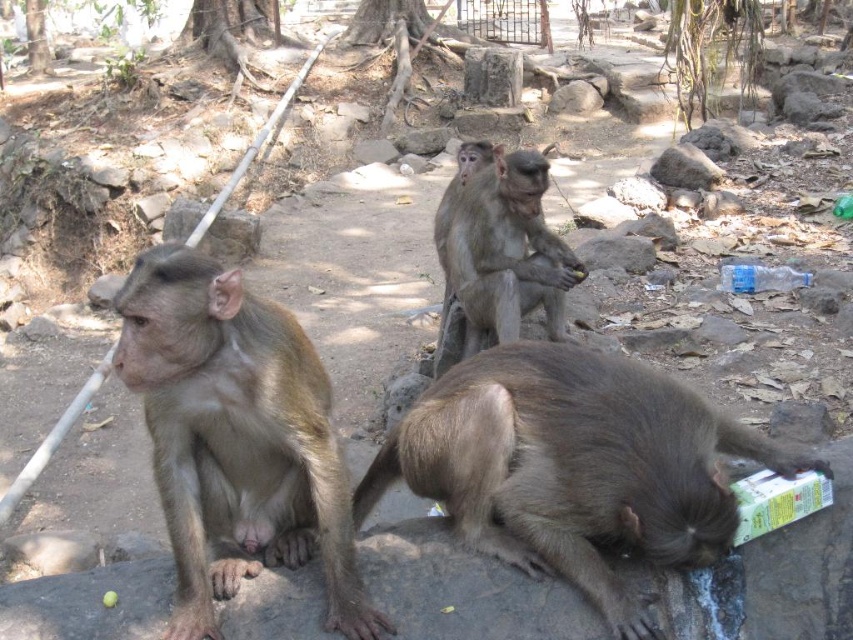
You are a wildlife photographer standing at the camera position. You want to capture a closeup shot of the brown furry monkey at lower right. Given that your camera has a minimum focusing distance of 5 feet, will you be able to take a clear photo?

The brown furry monkey at lower right is 6.56 feet away from the camera. Since the minimum focusing distance is 5 feet, the camera can focus clearly at that distance, so yes, you can take a clear photo.

You are standing at the point marked by the coordinates point (x=235, y=436) in the image. Looking around, you see a fuzzy brown monkey at left. What is the first object you would encounter if you walk directly towards the metal pipe running diagonally from the left side towards the center?

The first object you would encounter is the fuzzy brown monkey at left because it is located at the starting point marked by the coordinates point (x=235, y=436).